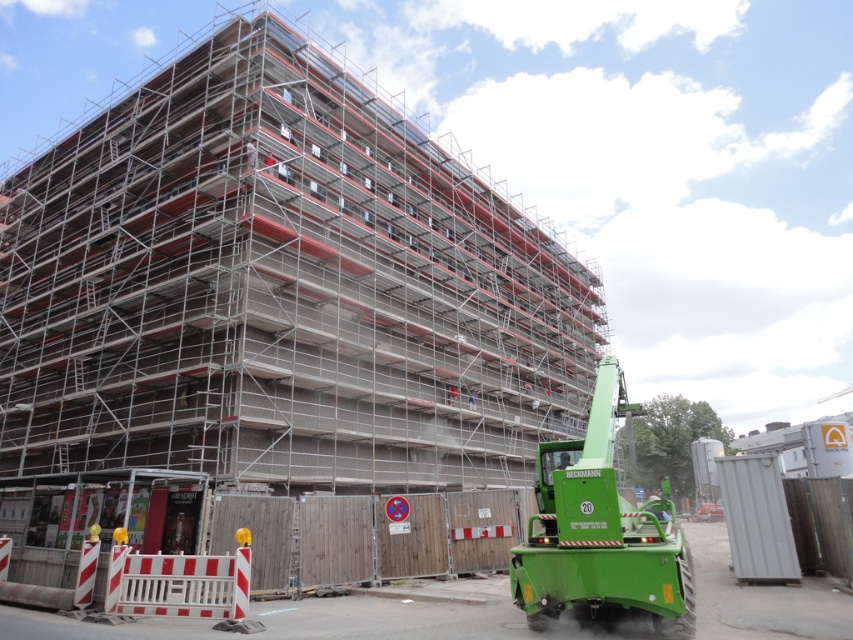
Who is positioned more to the right, silver metallic scaffolding at center or red and white plastic barricade at lower left?

From the viewer's perspective, silver metallic scaffolding at center appears more on the right side.

Does point (221, 385) lie behind point (212, 614)?

Yes, it is behind point (212, 614).

The height and width of the screenshot is (640, 853). What do you see at coordinates (280, 288) in the screenshot? I see `silver metallic scaffolding at center` at bounding box center [280, 288].

Locate an element on the screen. This screenshot has width=853, height=640. silver metallic scaffolding at center is located at coordinates (280, 288).

Between green metallic crane at lower right and red and white plastic barricade at lower left, which one has less height?

red and white plastic barricade at lower left is shorter.

Is point (543, 529) closer to viewer compared to point (158, 604)?

Yes, it is.

Locate an element on the screen. green metallic crane at lower right is located at coordinates (601, 531).

Can you confirm if silver metallic scaffolding at center is smaller than green metallic crane at lower right?

No.

In the scene shown: Is silver metallic scaffolding at center wider than green metallic crane at lower right?

Yes.

Between point (460, 380) and point (529, 589), which one is positioned in front?

Point (529, 589) is more forward.

Where is `silver metallic scaffolding at center`? silver metallic scaffolding at center is located at coordinates (280, 288).